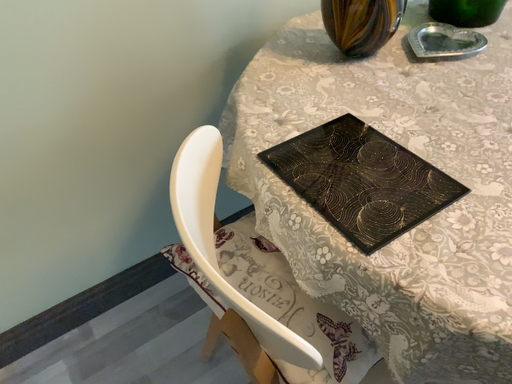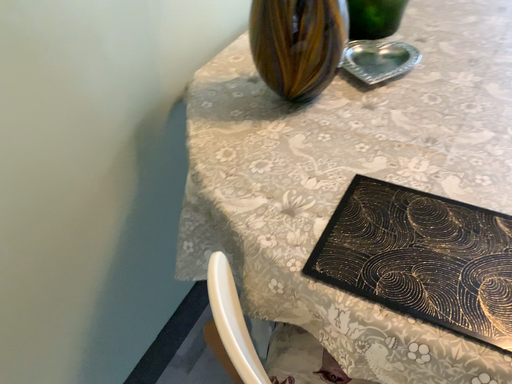
Question: Which way did the camera rotate in the video?

Choices:
 (A) rotated right
 (B) rotated left

Answer: (A)